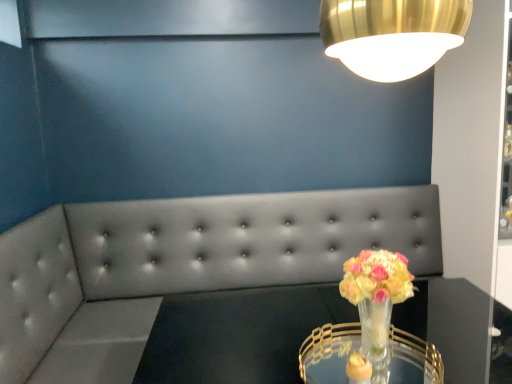
The width and height of the screenshot is (512, 384). Describe the element at coordinates (179, 266) in the screenshot. I see `tufted leather couch at center` at that location.

Image resolution: width=512 pixels, height=384 pixels. What do you see at coordinates (377, 302) in the screenshot?
I see `translucent glass vase at center` at bounding box center [377, 302].

What do you see at coordinates (328, 353) in the screenshot?
I see `clear glass table at center` at bounding box center [328, 353].

The width and height of the screenshot is (512, 384). In order to click on clear glass table at center in this screenshot , I will do `click(328, 353)`.

The width and height of the screenshot is (512, 384). What are the coordinates of `tufted leather couch at center` in the screenshot? It's located at (179, 266).

Does point (298, 359) come closer to viewer compared to point (341, 319)?

Yes.

How many degrees apart are the facing directions of clear glass table at center and clear glass table at center?

The facing directions of clear glass table at center and clear glass table at center are 3.62 degrees apart.

Is clear glass table at center facing towards clear glass table at center?

No, clear glass table at center is not facing towards clear glass table at center.

Is clear glass table at center completely or partially inside clear glass table at center?

That's incorrect, clear glass table at center is not inside clear glass table at center.

Can you see clear glass table at center touching clear glass table at center?

No.

I want to click on table above the clear glass table at center (from the image's perspective), so click(328, 353).

Is tufted leather couch at center at the left side of translucent glass vase at center?

Indeed, tufted leather couch at center is positioned on the left side of translucent glass vase at center.

Who is taller, tufted leather couch at center or translucent glass vase at center?

With more height is tufted leather couch at center.

In order to click on floral arrangement in front of the tufted leather couch at center in this screenshot , I will do `click(377, 302)`.

Does tufted leather couch at center have a smaller size compared to translucent glass vase at center?

No.

Are clear glass table at center and translucent glass vase at center located far from each other?

That's not correct — clear glass table at center is a little close to translucent glass vase at center.

Is translucent glass vase at center inside clear glass table at center?

No, clear glass table at center does not contain translucent glass vase at center.

Does point (401, 383) come closer to viewer compared to point (350, 282)?

No, it is not.

How many degrees apart are the facing directions of clear glass table at center and translucent glass vase at center?

clear glass table at center and translucent glass vase at center are facing 3.87 degrees away from each other.

Choose the correct answer: Is tufted leather couch at center inside clear glass table at center or outside it?

tufted leather couch at center is not enclosed by clear glass table at center.

Looking at the image, does tufted leather couch at center seem bigger or smaller compared to clear glass table at center?

Considering their sizes, tufted leather couch at center takes up more space than clear glass table at center.

Are tufted leather couch at center and clear glass table at center far apart?

No, tufted leather couch at center is not far from clear glass table at center.

From a real-world perspective, who is located lower, tufted leather couch at center or clear glass table at center?

tufted leather couch at center is physically lower.

Can you see translucent glass vase at center touching clear glass table at center?

There is a gap between translucent glass vase at center and clear glass table at center.

What are the coordinates of `floral arrangement located on the right of clear glass table at center` in the screenshot? It's located at (377, 302).

In the scene shown: Is translucent glass vase at center turned away from clear glass table at center?

No, translucent glass vase at center is not facing the opposite direction of clear glass table at center.

From the image's perspective, which is below, translucent glass vase at center or clear glass table at center?

clear glass table at center appears lower in the image.

Is point (412, 277) positioned after point (362, 215)?

No, (412, 277) is closer to viewer.

Is translucent glass vase at center smaller than tufted leather couch at center?

Indeed, translucent glass vase at center has a smaller size compared to tufted leather couch at center.

From the picture: Can you confirm if translucent glass vase at center is thinner than tufted leather couch at center?

Correct, the width of translucent glass vase at center is less than that of tufted leather couch at center.

Is tufted leather couch at center a part of translucent glass vase at center?

No, translucent glass vase at center does not contain tufted leather couch at center.

What are the coordinates of `round table below the clear glass table at center (from the image's perspective)` in the screenshot? It's located at (237, 335).

Locate an element on the screen. This screenshot has height=384, width=512. table that appears above the clear glass table at center (from a real-world perspective) is located at coordinates (328, 353).

From the image, which object appears to be farther from clear glass table at center, translucent glass vase at center or tufted leather couch at center?

Based on the image, tufted leather couch at center appears to be further to clear glass table at center.

Estimate the real-world distances between objects in this image. Which object is closer to translucent glass vase at center, clear glass table at center or tufted leather couch at center?

The object closer to translucent glass vase at center is clear glass table at center.

Which object lies further to the anchor point clear glass table at center, tufted leather couch at center or clear glass table at center?

The object further to clear glass table at center is tufted leather couch at center.

Looking at the image, which one is located closer to translucent glass vase at center, clear glass table at center or clear glass table at center?

clear glass table at center is positioned closer to the anchor translucent glass vase at center.

Based on their spatial positions, is clear glass table at center or tufted leather couch at center closer to clear glass table at center?

clear glass table at center is positioned closer to the anchor clear glass table at center.

Estimate the real-world distances between objects in this image. Which object is closer to tufted leather couch at center, clear glass table at center or translucent glass vase at center?

Based on the image, clear glass table at center appears to be nearer to tufted leather couch at center.

From the image, which object appears to be nearer to tufted leather couch at center, translucent glass vase at center or clear glass table at center?

The object closer to tufted leather couch at center is clear glass table at center.

Which object lies nearer to the anchor point clear glass table at center, clear glass table at center or tufted leather couch at center?

Among the two, clear glass table at center is located nearer to clear glass table at center.

Identify the location of round table between clear glass table at center and tufted leather couch at center from front to back. (237, 335).

Locate an element on the screen. This screenshot has height=384, width=512. round table positioned between translucent glass vase at center and tufted leather couch at center from near to far is located at coordinates (237, 335).

Locate an element on the screen. The height and width of the screenshot is (384, 512). table between translucent glass vase at center and clear glass table at center in the vertical direction is located at coordinates (328, 353).

Find the location of `floral arrangement positioned between clear glass table at center and tufted leather couch at center from near to far`. floral arrangement positioned between clear glass table at center and tufted leather couch at center from near to far is located at coordinates (377, 302).